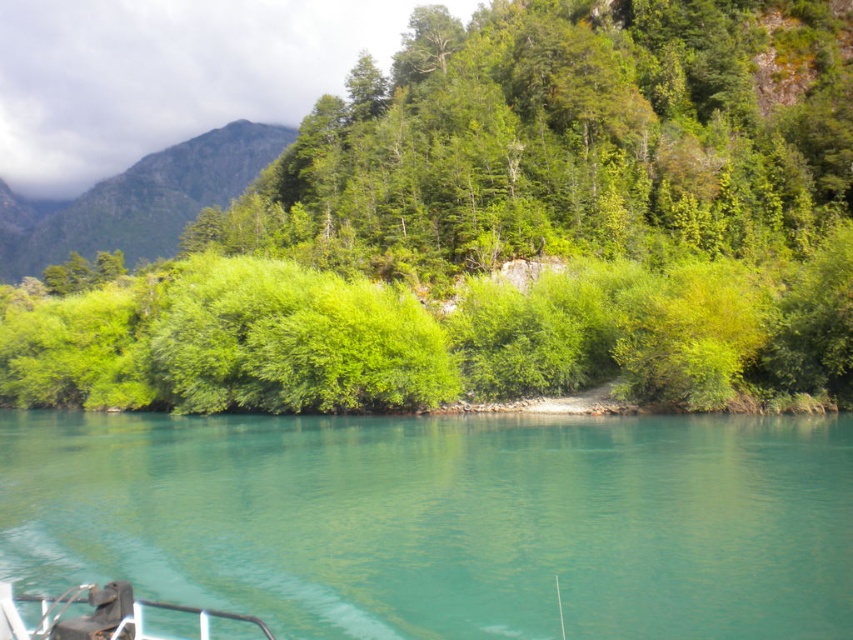
Question: Among these objects, which one is nearest to the camera?

Choices:
 (A) green water at center
 (B) green leafy shrub at center

Answer: (A)

Question: Which of the following is the closest to the observer?

Choices:
 (A) green leafy hillside at upper left
 (B) black rubber boat at lower left

Answer: (B)

Question: Does green leafy shrub at center appear under green water at center?

Choices:
 (A) no
 (B) yes

Answer: (A)

Question: Which object is farther from the camera taking this photo?

Choices:
 (A) black rubber boat at lower left
 (B) green water at center
 (C) green leafy shrub at center

Answer: (C)

Question: Where is green leafy shrub at center located in relation to green leafy hillside at upper left in the image?

Choices:
 (A) above
 (B) below

Answer: (B)

Question: Is green water at center wider than green leafy hillside at upper left?

Choices:
 (A) no
 (B) yes

Answer: (A)